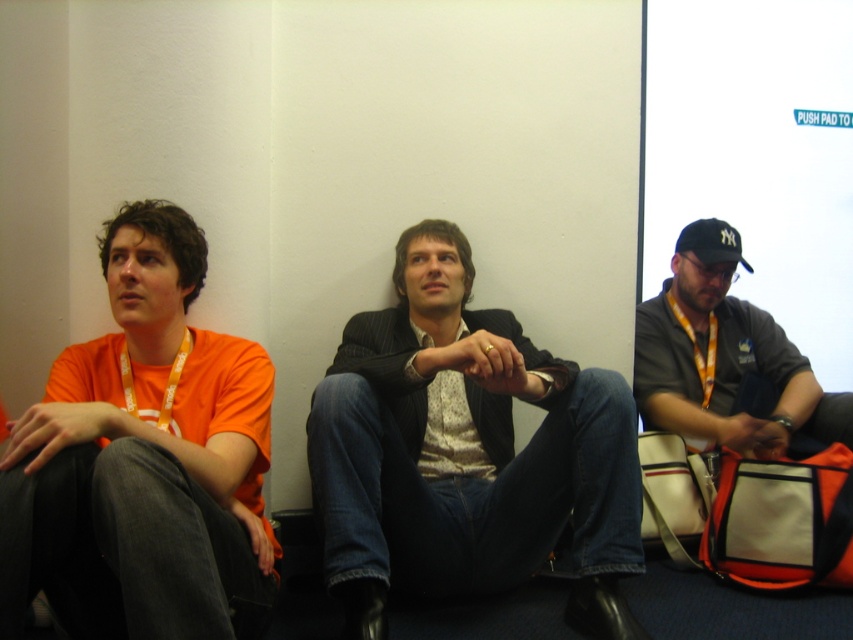
What do you see at coordinates (466, 452) in the screenshot? I see `matte black suit at center` at bounding box center [466, 452].

Consider the image. Does matte black suit at center have a lesser width compared to black fabric baseball cap at right?

Incorrect, matte black suit at center's width is not less than black fabric baseball cap at right's.

Describe the element at coordinates (466, 452) in the screenshot. I see `matte black suit at center` at that location.

Identify the location of matte black suit at center. This screenshot has height=640, width=853. (466, 452).

Between matte black suit at center and orange t-shirt at left, which one appears on the left side from the viewer's perspective?

orange t-shirt at left

Who is positioned more to the right, matte black suit at center or orange t-shirt at left?

matte black suit at center

Who is more distant from viewer, [521,400] or [238,548]?

The point [521,400] is more distant.

Image resolution: width=853 pixels, height=640 pixels. What are the coordinates of `matte black suit at center` in the screenshot? It's located at (466, 452).

Who is lower down, orange t-shirt at left or black fabric baseball cap at right?

orange t-shirt at left is below.

Identify the location of orange t-shirt at left. (143, 461).